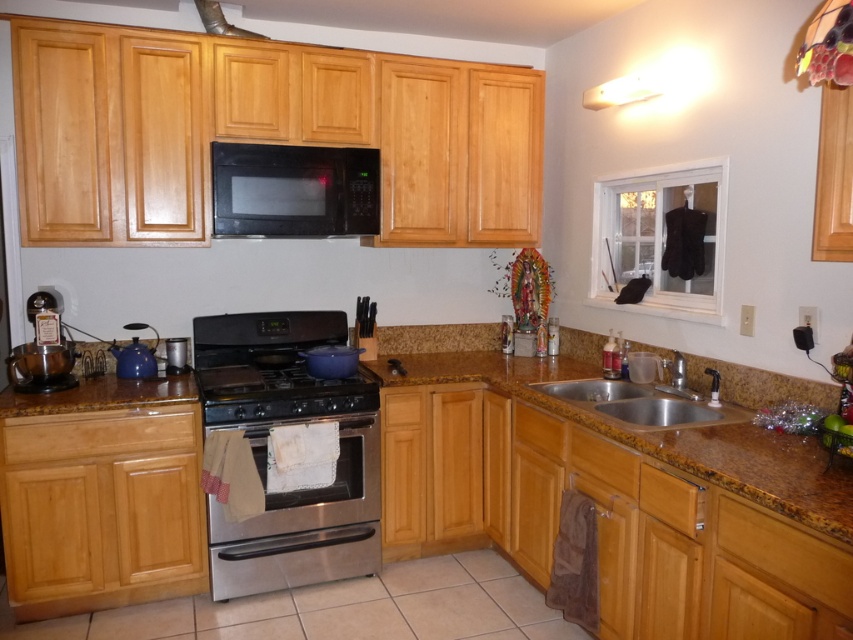
Between stainless steel stove at center and stainless steel sink at lower right, which one has more height?

stainless steel stove at center is taller.

Is point (369, 385) farther from viewer compared to point (587, 406)?

That is True.

This screenshot has height=640, width=853. I want to click on stainless steel stove at center, so click(273, 387).

Is point (780, 488) positioned before point (218, 390)?

Yes, it is in front of point (218, 390).

Is brown granite countertop at center taller than stainless steel stove at center?

Correct, brown granite countertop at center is much taller as stainless steel stove at center.

Identify the location of brown granite countertop at center. (662, 435).

Based on the photo, can you confirm if stainless steel stove at center is taller than metallic silver exhaust hood at upper center?

Yes.

Can you confirm if stainless steel stove at center is smaller than metallic silver exhaust hood at upper center?

No, stainless steel stove at center is not smaller than metallic silver exhaust hood at upper center.

Measure the distance between point (212, 416) and camera.

The distance of point (212, 416) from camera is 9.06 feet.

Find the location of a particular element. The image size is (853, 640). stainless steel stove at center is located at coordinates (273, 387).